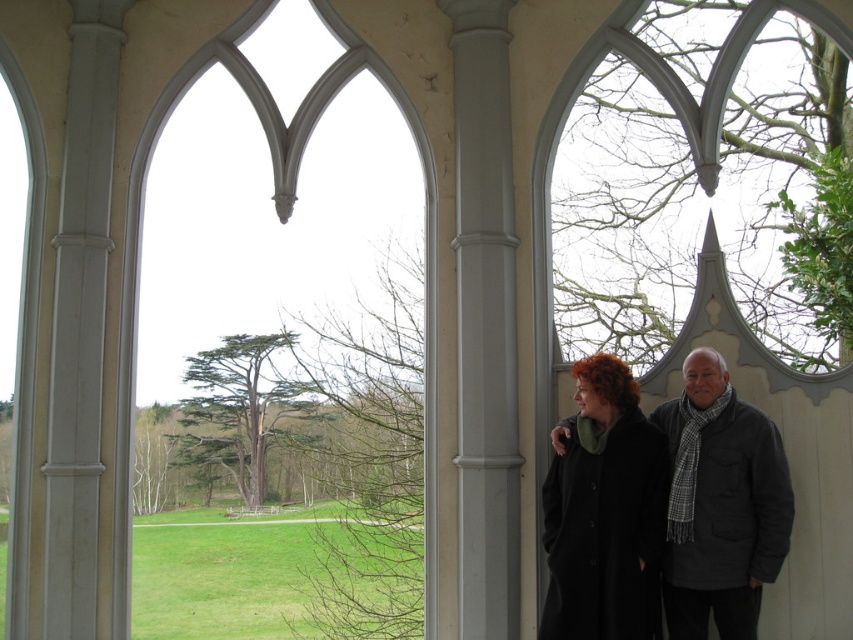
Question: Among these objects, which one is farthest from the camera?

Choices:
 (A) clear glass window at center
 (B) gray smooth column at center
 (C) dark gray wool scarf at right
 (D) black wool coat at center

Answer: (A)

Question: Does clear glass window at center appear on the right side of dark gray wool scarf at right?

Choices:
 (A) no
 (B) yes

Answer: (A)

Question: Is black wool coat at center below dark gray wool scarf at right?

Choices:
 (A) no
 (B) yes

Answer: (B)

Question: Does clear glass window at center have a smaller size compared to dark gray wool scarf at right?

Choices:
 (A) no
 (B) yes

Answer: (A)

Question: Which of the following is the farthest from the observer?

Choices:
 (A) (439, 3)
 (B) (135, 328)
 (C) (749, 557)

Answer: (A)

Question: Which point is farther from the camera taking this photo?

Choices:
 (A) (697, 600)
 (B) (157, 380)
 (C) (457, 84)

Answer: (B)